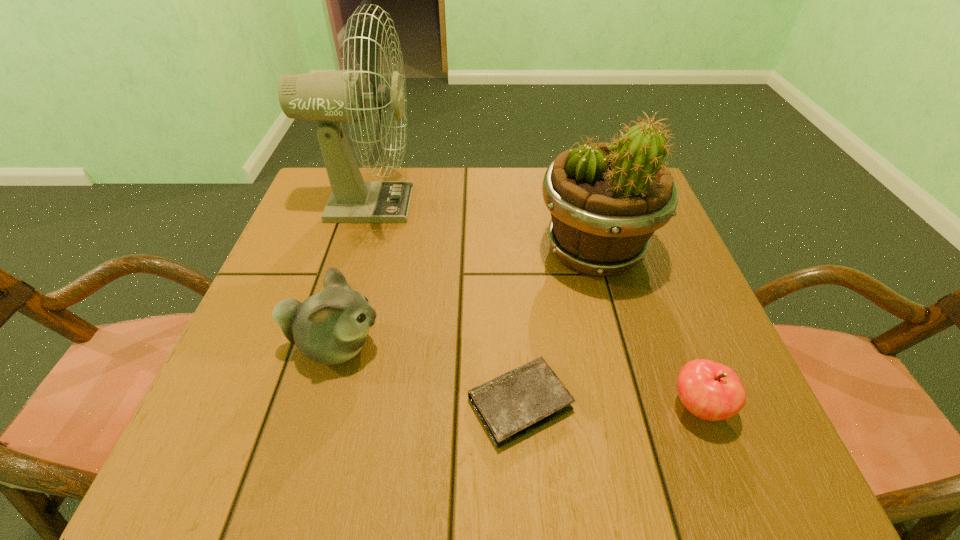
Identify the location of free area in between the shortest object and the fan. (444, 304).

Where is `free space between the flowerpot and the apple`? free space between the flowerpot and the apple is located at coordinates (646, 329).

Locate an element on the screen. The image size is (960, 540). free space between the apple and the flowerpot is located at coordinates (646, 329).

I want to click on vacant region between the third tallest object and the diary, so click(x=428, y=375).

In order to click on free point between the fan and the second tallest object in this screenshot , I will do `click(480, 228)`.

Locate an element on the screen. The width and height of the screenshot is (960, 540). empty space between the shortest object and the apple is located at coordinates (610, 405).

Where is `free spot between the hamster and the tallest object`? free spot between the hamster and the tallest object is located at coordinates (351, 275).

This screenshot has height=540, width=960. I want to click on vacant point located between the hamster and the tallest object, so click(x=351, y=275).

Point out which object is positioned as the fourth nearest to the fan. Please provide its 2D coordinates. Your answer should be formatted as a tuple, i.e. [(x, y)], where the tuple contains the x and y coordinates of a point satisfying the conditions above.

[(711, 391)]

At what (x,y) coordinates should I click in order to perform the action: click on object identified as the second closest to the diary. Please return your answer as a coordinate pair (x, y). The height and width of the screenshot is (540, 960). Looking at the image, I should click on (711, 391).